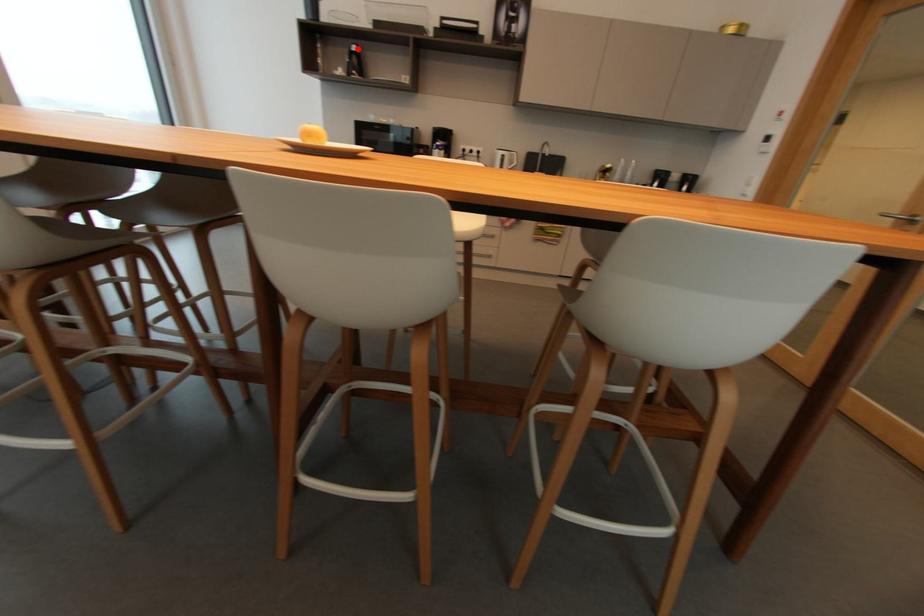
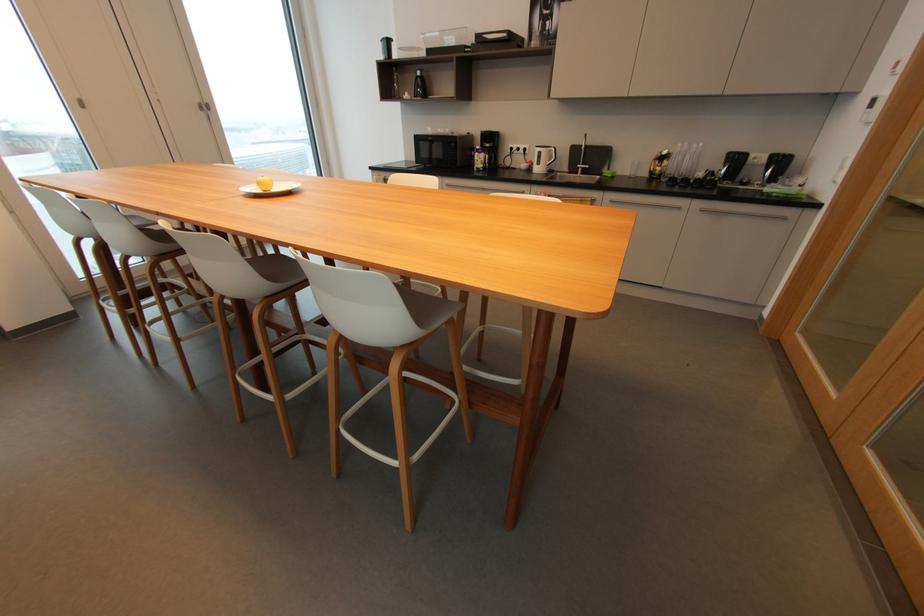
Question: I am providing you with two images of the same scene from different viewpoints. Given a red point in image1, look at the same physical point in image2. Is it:

Choices:
 (A) Closer to the viewpoint
 (B) Farther from the viewpoint

Answer: (A)